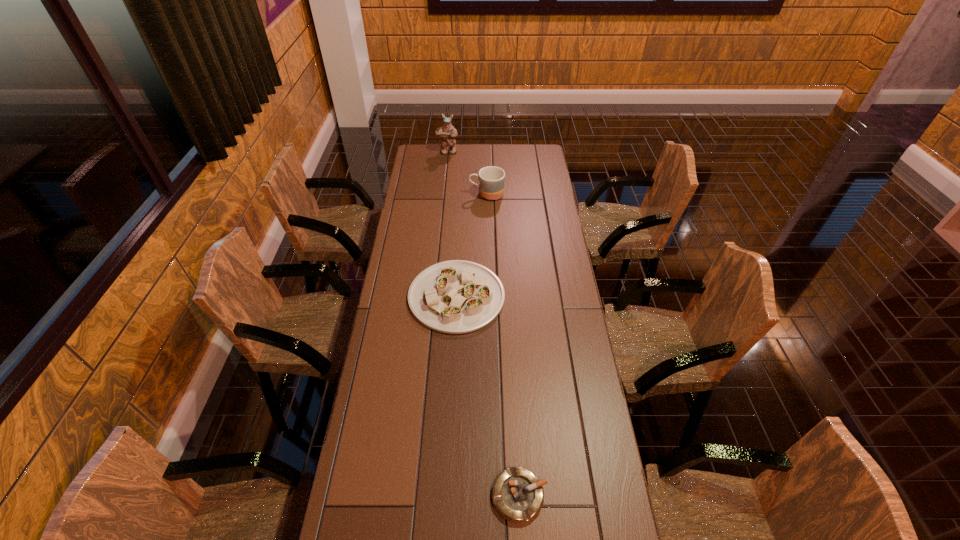
Identify the location of blank space at the right edge. (535, 234).

This screenshot has width=960, height=540. I want to click on free space at the far right corner of the desktop, so click(535, 156).

Locate an element on the screen. The width and height of the screenshot is (960, 540). empty space that is in between the third shortest object and the second nearest object is located at coordinates (471, 245).

Identify the location of vacant region between the second shortest object and the shortest object. (488, 396).

At what (x,y) coordinates should I click in order to perform the action: click on free point between the third shortest object and the nearest object. Please return your answer as a coordinate pair (x, y). The width and height of the screenshot is (960, 540). Looking at the image, I should click on (503, 345).

Where is `free space that is in between the third nearest object and the second nearest object`? This screenshot has width=960, height=540. free space that is in between the third nearest object and the second nearest object is located at coordinates (471, 245).

Identify the location of free space between the mug and the third tallest object. tap(471, 245).

Locate an element on the screen. Image resolution: width=960 pixels, height=540 pixels. free space between the second shortest object and the mug is located at coordinates (471, 245).

Find the location of a particular element. vacant region between the nearest object and the second nearest object is located at coordinates (488, 396).

The height and width of the screenshot is (540, 960). What are the coordinates of `vacant space that's between the second tallest object and the nearest object` in the screenshot? It's located at tap(503, 345).